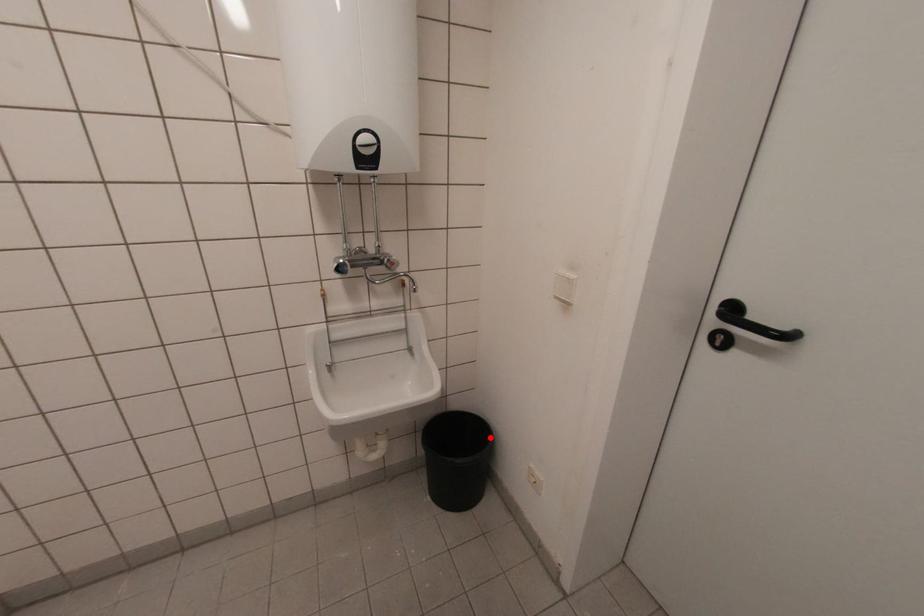
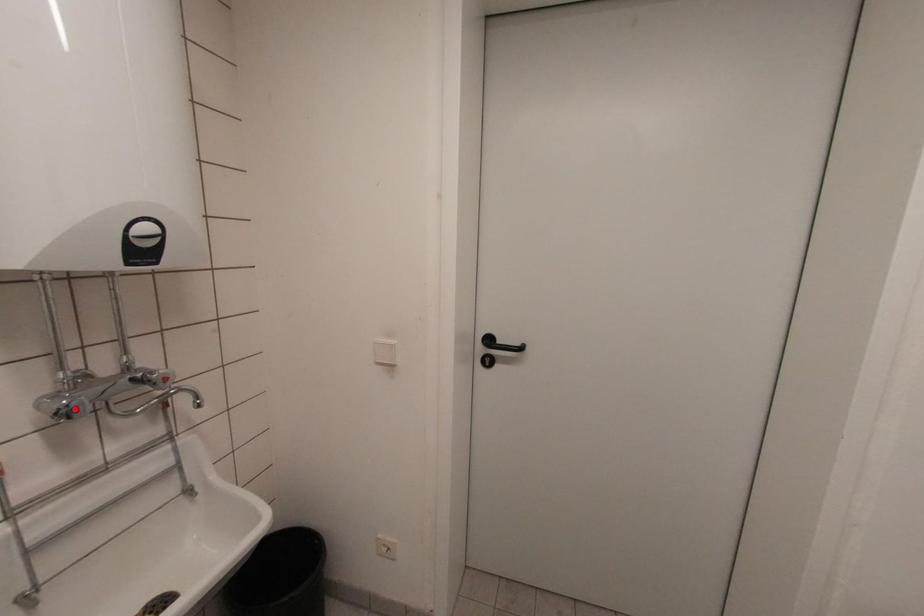
I am providing you with two images of the same scene from different viewpoints. A red point is marked on the first image and another point is marked on the second image. Do the highlighted points in image1 and image2 indicate the same real-world spot?

No